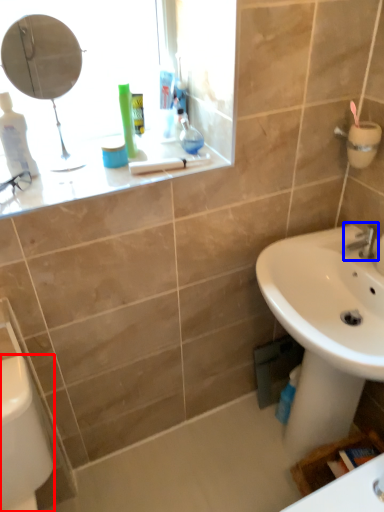
Question: Which of the following is the closest to the observer, porcelain (highlighted by a red box) or tap (highlighted by a blue box)?

Choices:
 (A) porcelain
 (B) tap

Answer: (A)